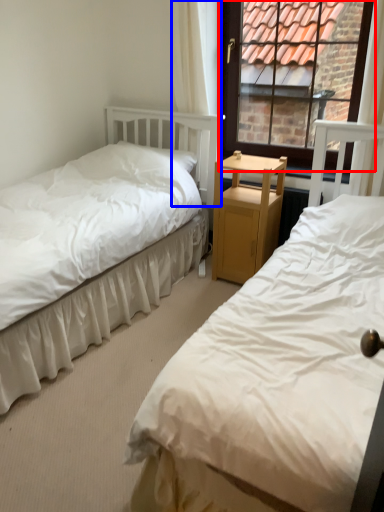
Question: Among these objects, which one is farthest to the camera, window (highlighted by a red box) or curtain (highlighted by a blue box)?

Choices:
 (A) window
 (B) curtain

Answer: (B)